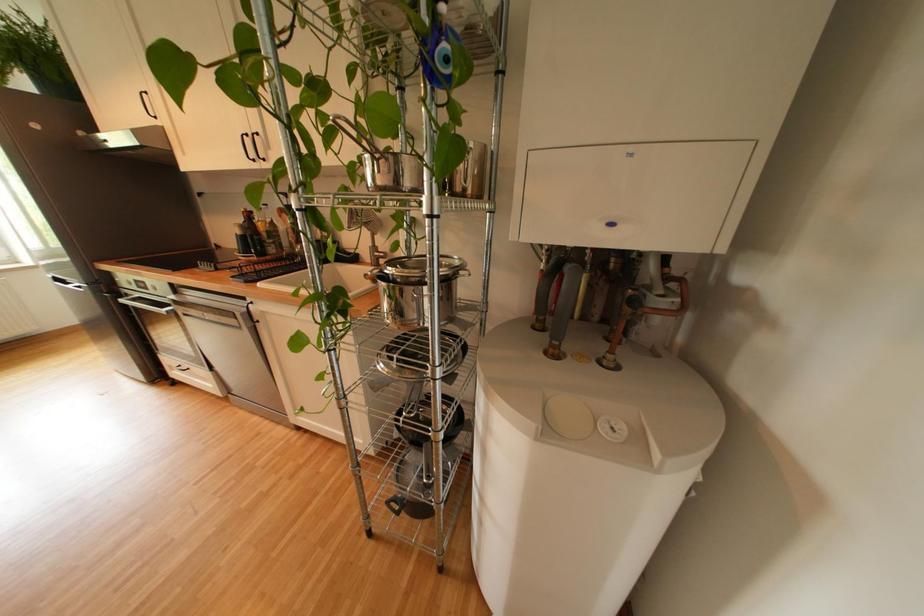
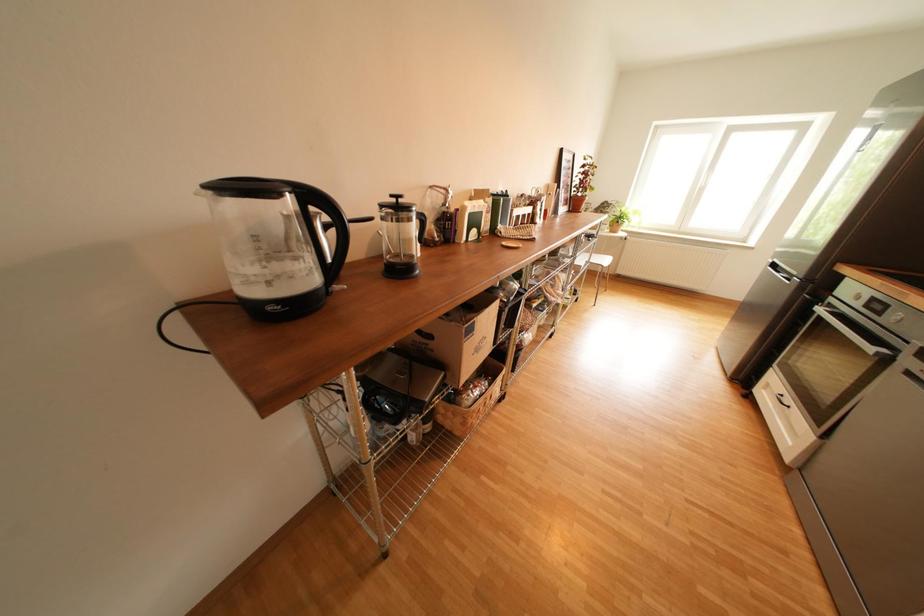
Based on the photo, the first image is from the beginning of the video and the second image is from the end. How did the camera likely rotate when shooting the video?

The rotation direction of the camera is left-down.